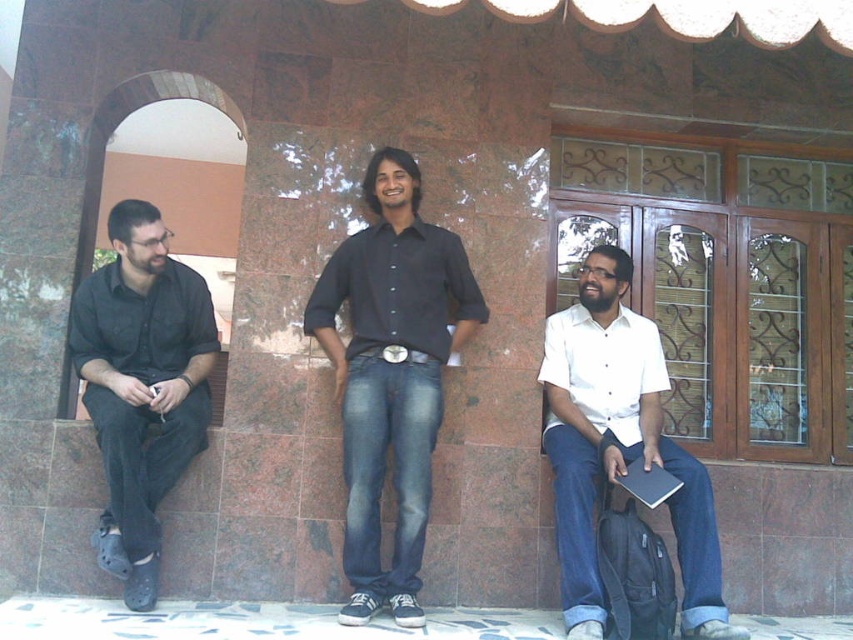
Who is lower down, white matte shirt at center or black matte shirt at left?

white matte shirt at center is below.

Is white matte shirt at center positioned in front of black matte shirt at left?

Yes, white matte shirt at center is in front of black matte shirt at left.

Image resolution: width=853 pixels, height=640 pixels. I want to click on white matte shirt at center, so click(x=619, y=448).

This screenshot has width=853, height=640. I want to click on white matte shirt at center, so click(x=619, y=448).

Who is more forward, (405,161) or (647,369)?

Point (405,161)

Looking at this image, is black denim jeans at center above white matte shirt at center?

Yes.

Identify the location of black denim jeans at center. (392, 372).

Is black denim jeans at center closer to camera compared to black matte shirt at left?

Yes, it is in front of black matte shirt at left.

Can you confirm if black denim jeans at center is bigger than black matte shirt at left?

Yes.

Identify the location of black denim jeans at center. The width and height of the screenshot is (853, 640). tap(392, 372).